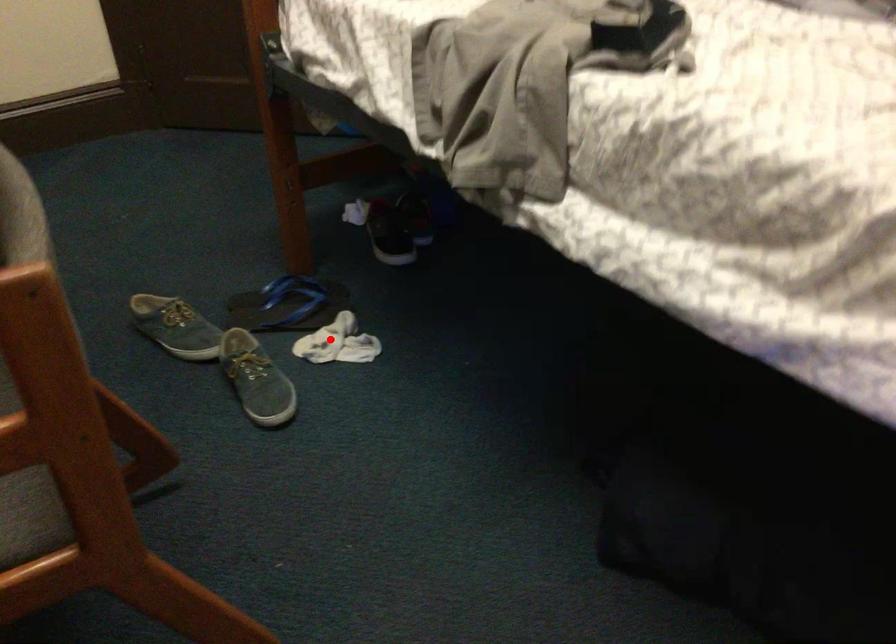
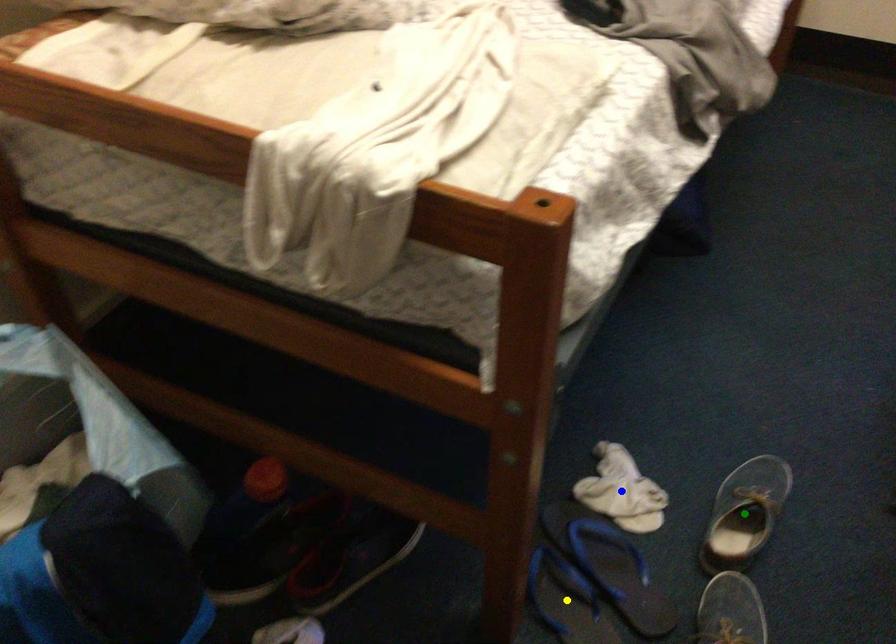
Question: I am providing you with two images of the same scene from different viewpoints. A red point is marked on the first image. You are given multiple points on the second image. Can you choose the point in image 2 that corresponds to the point in image 1?

Choices:
 (A) green point
 (B) blue point
 (C) yellow point

Answer: (B)